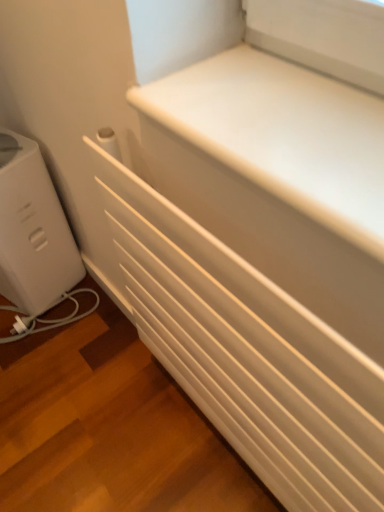
Question: From the image's perspective, is white matte radiator at center on top of white matte radiator at lower left?

Choices:
 (A) no
 (B) yes

Answer: (B)

Question: From the image's perspective, is white matte radiator at center located beneath white matte radiator at lower left?

Choices:
 (A) no
 (B) yes

Answer: (A)

Question: From a real-world perspective, is white matte radiator at center positioned under white matte radiator at lower left based on gravity?

Choices:
 (A) no
 (B) yes

Answer: (A)

Question: From a real-world perspective, is white matte radiator at center on top of white matte radiator at lower left?

Choices:
 (A) no
 (B) yes

Answer: (B)

Question: Is the position of white matte radiator at center more distant than that of white matte radiator at lower left?

Choices:
 (A) no
 (B) yes

Answer: (A)

Question: Can you confirm if white matte radiator at center is smaller than white matte radiator at lower left?

Choices:
 (A) no
 (B) yes

Answer: (B)

Question: Can you confirm if white matte radiator at lower left is smaller than white matte radiator at center?

Choices:
 (A) no
 (B) yes

Answer: (A)

Question: Considering the relative sizes of white matte radiator at lower left and white matte radiator at center in the image provided, is white matte radiator at lower left taller than white matte radiator at center?

Choices:
 (A) yes
 (B) no

Answer: (B)

Question: From a real-world perspective, is white matte radiator at lower left physically above white matte radiator at center?

Choices:
 (A) yes
 (B) no

Answer: (B)

Question: Is white matte radiator at lower left not within white matte radiator at center?

Choices:
 (A) yes
 (B) no

Answer: (A)

Question: Is white matte radiator at lower left positioned before white matte radiator at center?

Choices:
 (A) yes
 (B) no

Answer: (B)

Question: Does white matte radiator at lower left have a larger size compared to white matte radiator at center?

Choices:
 (A) no
 (B) yes

Answer: (B)

Question: Is white plastic toaster at left touching white matte radiator at center?

Choices:
 (A) yes
 (B) no

Answer: (B)